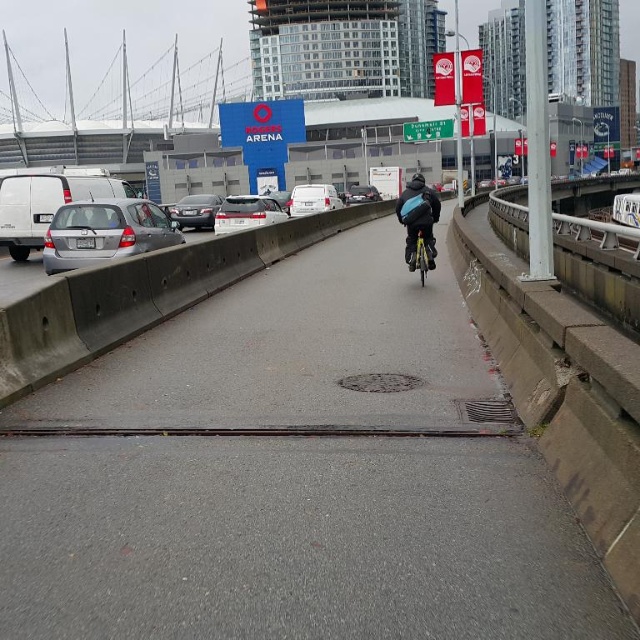
Question: Does silver metallic sedan at left have a greater width compared to satin silver sedan at center?

Choices:
 (A) yes
 (B) no

Answer: (B)

Question: Considering the real-world distances, which object is closest to the satin silver sedan at left?

Choices:
 (A) shiny silver car at center
 (B) gray concrete highway at center
 (C) blue fabric backpack at center
 (D) silver metallic sedan at left

Answer: (D)

Question: Among these objects, which one is nearest to the camera?

Choices:
 (A) satin silver sedan at center
 (B) gray concrete highway at center
 (C) silver metallic sedan at left

Answer: (B)

Question: Estimate the real-world distances between objects in this image. Which object is farther from the blue fabric backpack at center?

Choices:
 (A) satin silver sedan at center
 (B) satin silver sedan at left
 (C) silver metallic sedan at left
 (D) shiny metallic bicycle at center

Answer: (B)

Question: Can you confirm if gray concrete highway at center is smaller than shiny silver car at center?

Choices:
 (A) no
 (B) yes

Answer: (B)

Question: Observing the image, what is the correct spatial positioning of gray concrete highway at center in reference to blue fabric backpack at center?

Choices:
 (A) left
 (B) right

Answer: (A)